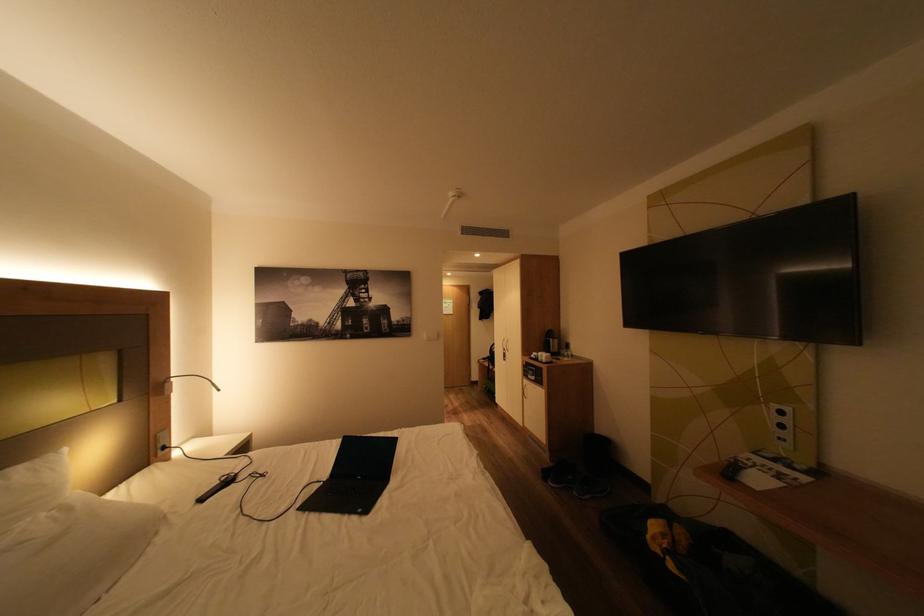
The location [551,342] corresponds to which object?

This point indicates the black coffee maker.